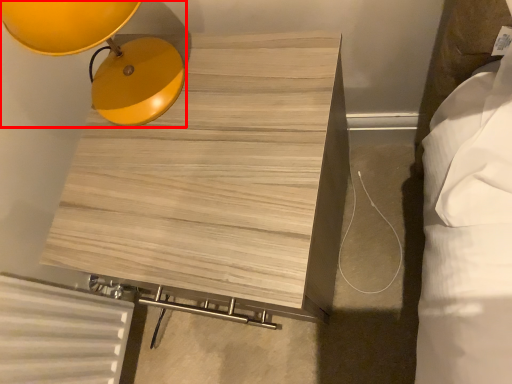
Question: Where is lamp (annotated by the red box) located in relation to furniture in the image?

Choices:
 (A) left
 (B) right

Answer: (A)